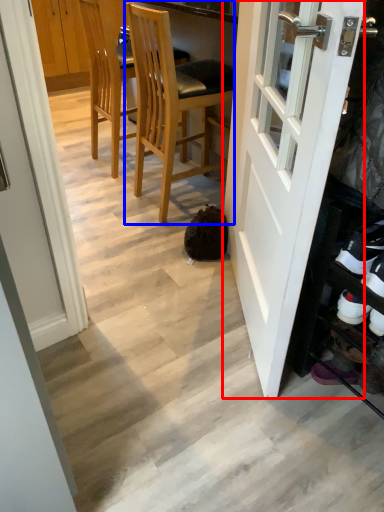
Question: Which of the following is the farthest to the observer, door (highlighted by a red box) or chair (highlighted by a blue box)?

Choices:
 (A) door
 (B) chair

Answer: (B)